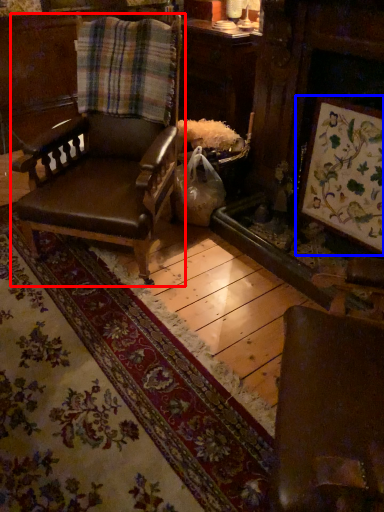
Question: Among these objects, which one is farthest to the camera, chair (highlighted by a red box) or picture frame (highlighted by a blue box)?

Choices:
 (A) chair
 (B) picture frame

Answer: (B)